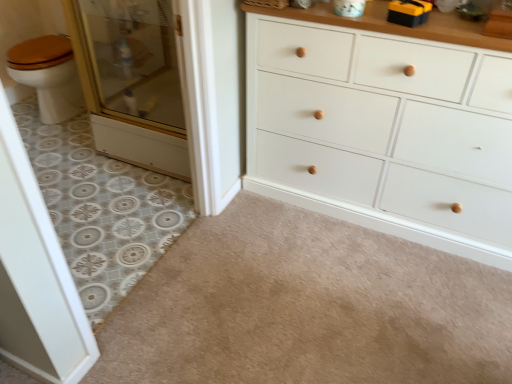
You are a GUI agent. You are given a task and a screenshot of the screen. Output one action in this format:
    pyautogui.click(x=<x>, y=<y>)
    Task: Click on the vacant space behind clear glass screen door at left, acting as the 2th screen door starting from the back
    The height and width of the screenshot is (384, 512).
    Given the screenshot: What is the action you would take?
    pyautogui.click(x=103, y=292)